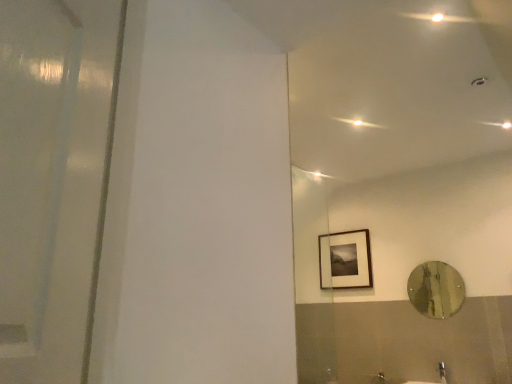
Question: From a real-world perspective, does satin nickel faucet at lower right sit lower than matte black picture frame at upper right?

Choices:
 (A) no
 (B) yes

Answer: (B)

Question: Is satin nickel faucet at lower right positioned with its back to matte black picture frame at upper right?

Choices:
 (A) no
 (B) yes

Answer: (A)

Question: Does satin nickel faucet at lower right lie behind matte black picture frame at upper right?

Choices:
 (A) no
 (B) yes

Answer: (A)

Question: From the image's perspective, is satin nickel faucet at lower right below matte black picture frame at upper right?

Choices:
 (A) yes
 (B) no

Answer: (A)

Question: Can you confirm if satin nickel faucet at lower right is thinner than matte black picture frame at upper right?

Choices:
 (A) yes
 (B) no

Answer: (B)

Question: From a real-world perspective, does satin nickel faucet at lower right stand above matte black picture frame at upper right?

Choices:
 (A) yes
 (B) no

Answer: (B)

Question: Is satin nickel faucet at lower right located within metallic reflective mirror at right?

Choices:
 (A) no
 (B) yes

Answer: (A)

Question: Is metallic reflective mirror at right to the left of satin nickel faucet at lower right from the viewer's perspective?

Choices:
 (A) yes
 (B) no

Answer: (B)

Question: Is metallic reflective mirror at right next to satin nickel faucet at lower right and touching it?

Choices:
 (A) yes
 (B) no

Answer: (B)

Question: Does metallic reflective mirror at right lie behind satin nickel faucet at lower right?

Choices:
 (A) yes
 (B) no

Answer: (A)

Question: From the image's perspective, is metallic reflective mirror at right on satin nickel faucet at lower right?

Choices:
 (A) yes
 (B) no

Answer: (A)

Question: From a real-world perspective, is metallic reflective mirror at right over satin nickel faucet at lower right?

Choices:
 (A) yes
 (B) no

Answer: (A)

Question: Is metallic reflective mirror at right bigger than matte black picture frame at upper right?

Choices:
 (A) no
 (B) yes

Answer: (A)